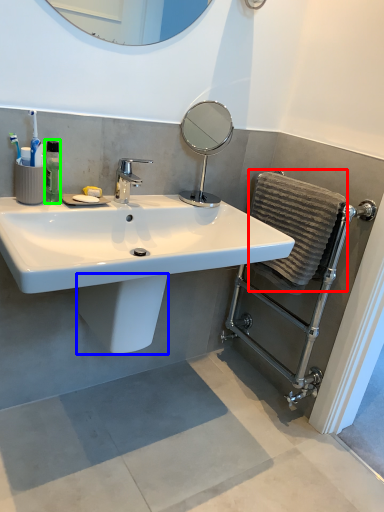
Question: Which is farther away from bath towel (highlighted by a red box)? bidet (highlighted by a blue box) or mouthwash (highlighted by a green box)?

Choices:
 (A) bidet
 (B) mouthwash

Answer: (B)